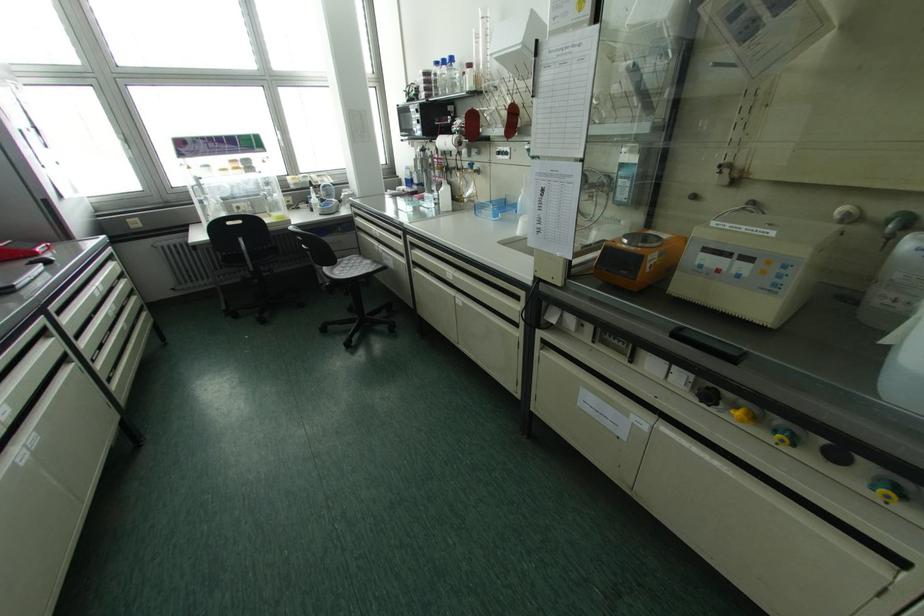
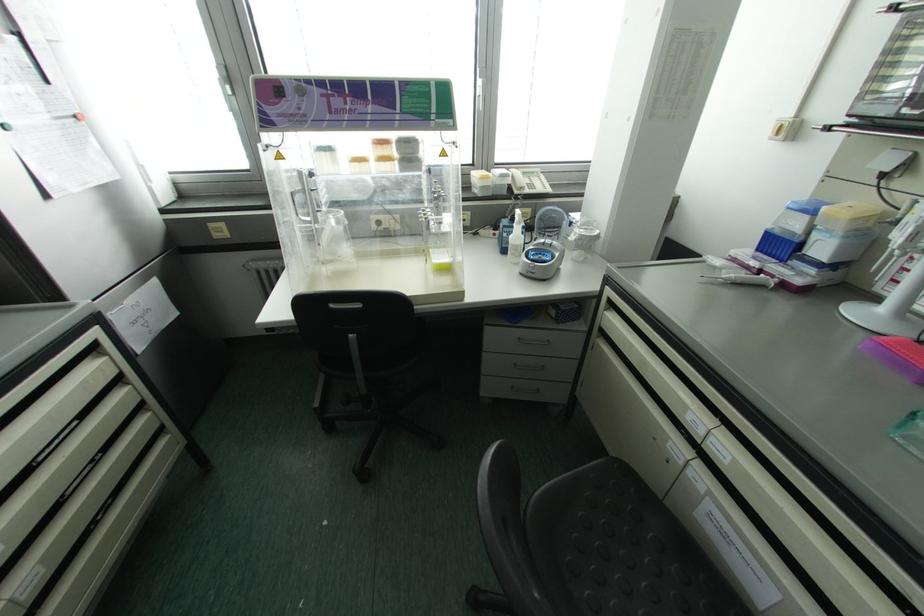
Locate, in the second image, the point that corresponds to point (313, 199) in the first image.

(516, 235)